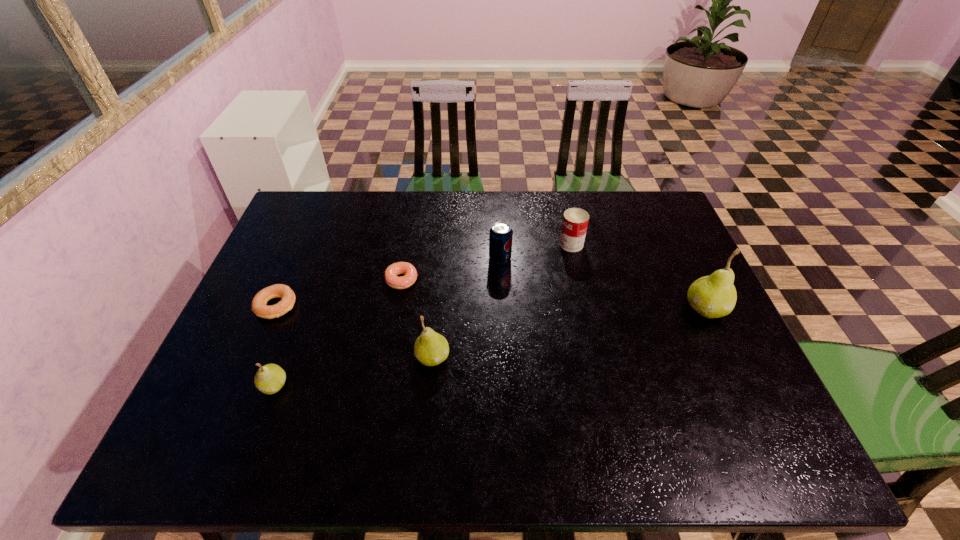
Where is `the shortest pear`? the shortest pear is located at coordinates (270, 378).

Locate an element on the screen. the nearest pear is located at coordinates (270, 378).

Identify the location of the second nearest object. (431, 348).

Locate an element on the screen. This screenshot has width=960, height=540. the second pear from right to left is located at coordinates (431, 348).

Image resolution: width=960 pixels, height=540 pixels. I want to click on the rightmost pear, so click(714, 296).

What are the coordinates of `the farthest pear` in the screenshot? It's located at (714, 296).

Find the location of a particular element. The width and height of the screenshot is (960, 540). can is located at coordinates (575, 221).

Where is `bagel`? bagel is located at coordinates (259, 303).

Locate an element on the screen. doughnut is located at coordinates (391, 278).

What are the coordinates of `soda can` in the screenshot? It's located at (500, 235).